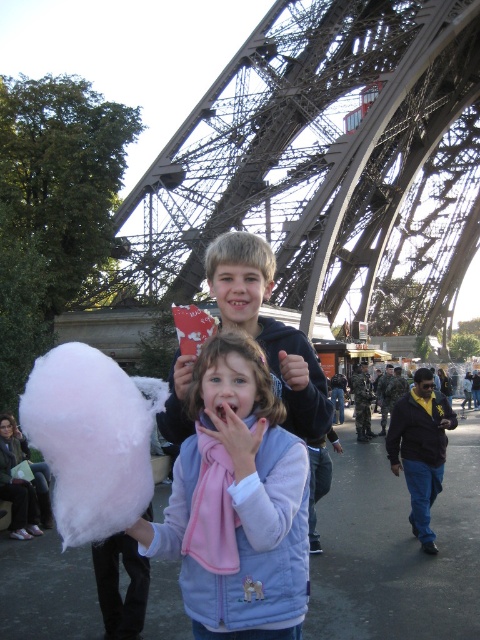
Looking at this image, you are standing at the base of the Eiffel Tower and want to take a photo of the white fluffy cotton candy at lower left. The camera you are using has a maximum zoom range of 50 meters. Can you capture a clear image of the cotton candy without moving closer?

The white fluffy cotton candy at lower left and camera are 73.16 meters apart, which exceeds the camera maximum zoom range of 50 meters. Therefore, you cannot capture a clear image without moving closer.

You are a photographer at the Eiffel Tower and want to take a picture of the dark blue jacket at center and the pink fleece scarf at center. Which object should you zoom in on to ensure both are clearly visible in the frame?

You should zoom in on the dark blue jacket at center because it is bigger than the pink fleece scarf at center, making it easier to capture both in the frame without losing detail.

You are a photographer standing at the base of the Eiffel Tower. You want to take a photo of the dark blue jacket at center and the pink fleece scarf at center so that both are clearly visible in the frame. Given their distance apart, is it possible to capture both in a single shot without zooming in?

The dark blue jacket at center and pink fleece scarf at center are 106.57 feet apart from each other. Since they are over 100 feet apart, it would be challenging to capture both in a single shot without zooming in, as most standard camera lenses have a limited field of view at such distances. The photographer would likely need to step back further or use a wide angle lens to include both in the frame.